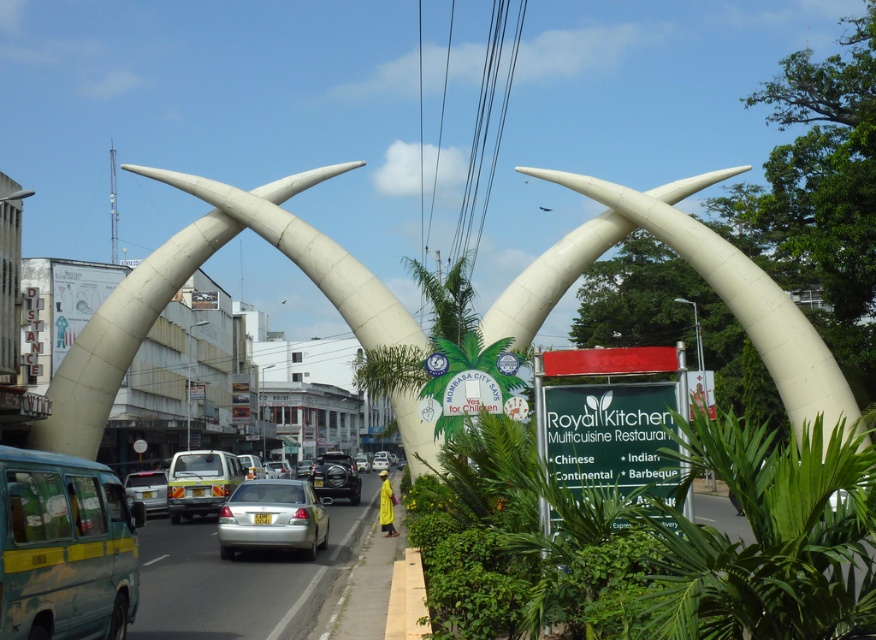
Question: Which of the following is the closest to the observer?

Choices:
 (A) (644, 214)
 (B) (223, 452)
 (C) (23, 488)
 (D) (124, 481)

Answer: (C)

Question: Which point is farther to the camera?

Choices:
 (A) (345, 490)
 (B) (592, 186)

Answer: (A)

Question: Does white polished stone arches at center have a lesser width compared to shiny black car at center?

Choices:
 (A) no
 (B) yes

Answer: (A)

Question: Is blue matte van at left further to the viewer compared to satin silver sedan at center?

Choices:
 (A) yes
 (B) no

Answer: (B)

Question: Among these objects, which one is nearest to the camera?

Choices:
 (A) shiny black car at center
 (B) silver metallic car at center

Answer: (B)

Question: From the image, what is the correct spatial relationship of white polished stone arches at center in relation to satin silver sedan at center?

Choices:
 (A) above
 (B) below

Answer: (A)